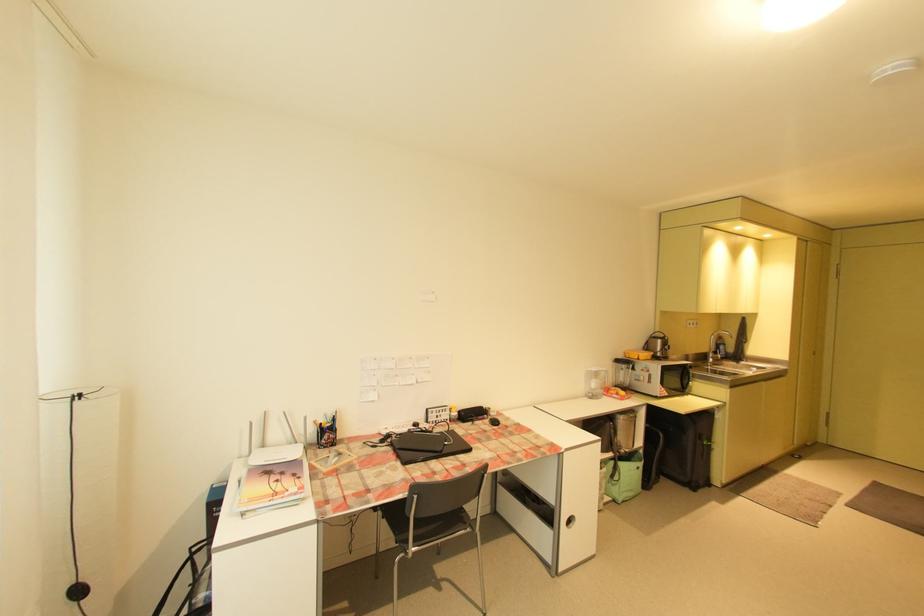
Where would you grip the black computer mouse? Please return your answer as a coordinate pair (x, y).

(493, 419)